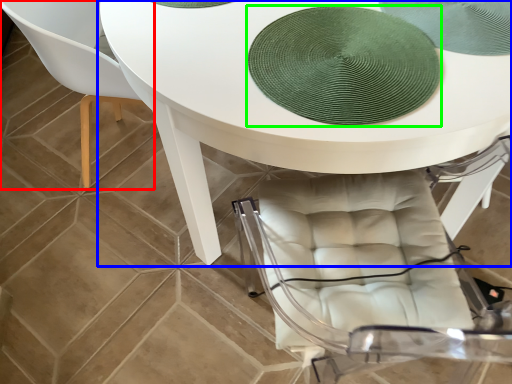
Question: Estimate the real-world distances between objects in this image. Which object is closer to chair (highlighted by a red box), table (highlighted by a blue box) or mat (highlighted by a green box)?

Choices:
 (A) table
 (B) mat

Answer: (A)